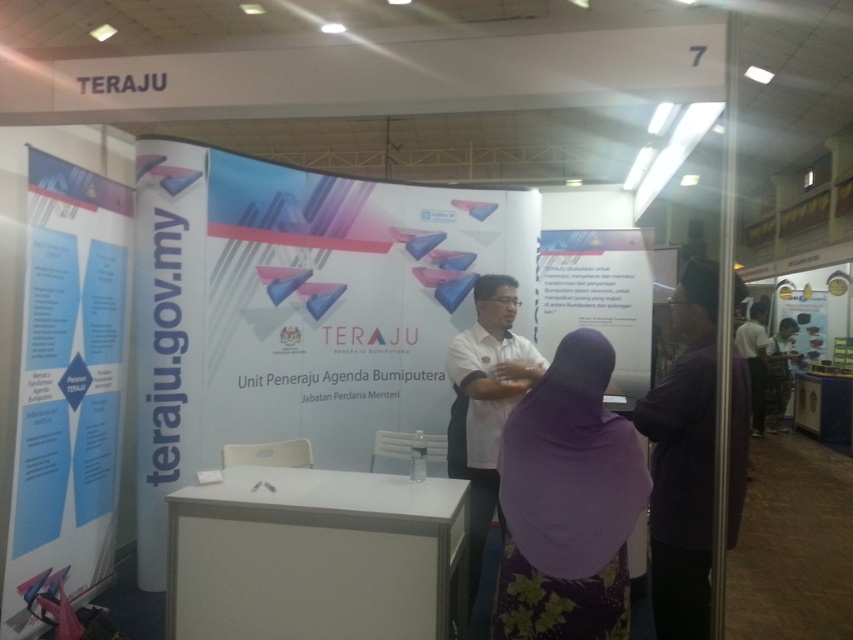
What is the position of the white paper at left relative to the white glossy poster at upper right in the TERAJU booth?

The white paper at left is positioned below the white glossy poster at upper right.